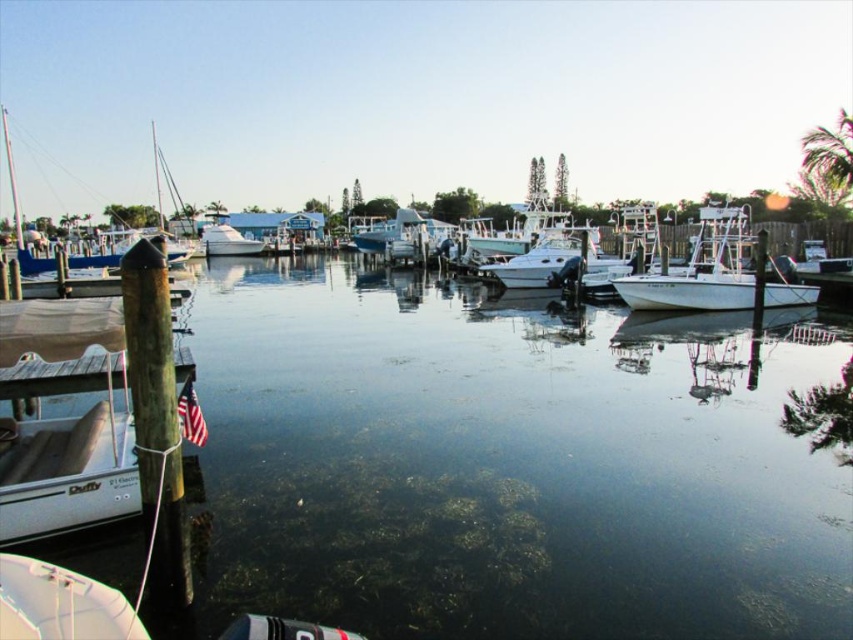
Question: Which of these objects is positioned farthest from the clear water at center?

Choices:
 (A) blue matte sailboat at left
 (B) white matte boat at right

Answer: (A)

Question: Which object is farther from the camera taking this photo?

Choices:
 (A) blue matte sailboat at left
 (B) white fiberglass boat at center
 (C) white matte boat at lower left

Answer: (B)

Question: Is white glossy boat at center wider than blue matte sailboat at left?

Choices:
 (A) yes
 (B) no

Answer: (B)

Question: Does white matte boat at right have a larger size compared to white matte boat at lower left?

Choices:
 (A) no
 (B) yes

Answer: (B)

Question: Where is clear water at center located in relation to white fiberglass boat at center in the image?

Choices:
 (A) above
 (B) below

Answer: (B)

Question: Considering the real-world distances, which object is closest to the white fiberglass boat at center?

Choices:
 (A) clear water at center
 (B) white glossy boat at center
 (C) blue matte sailboat at left

Answer: (B)